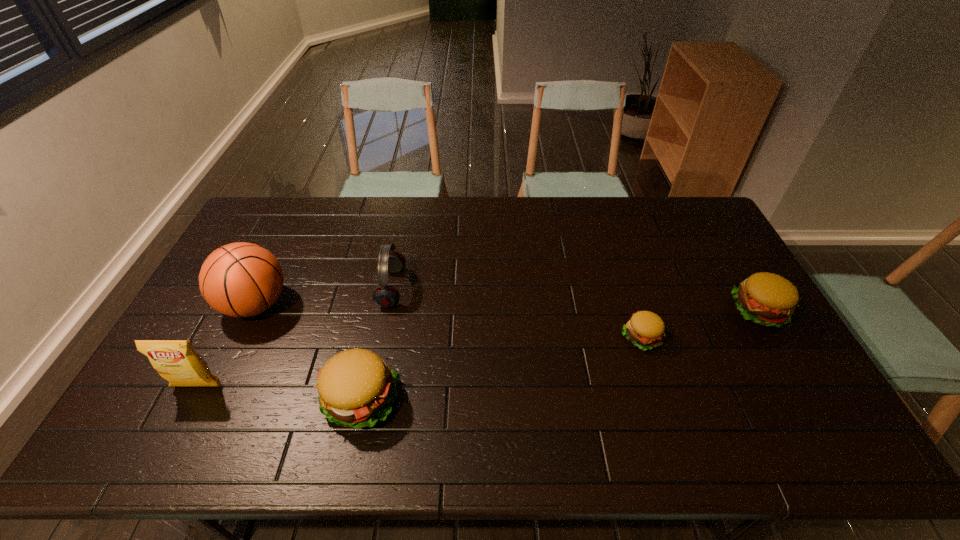
This screenshot has width=960, height=540. What are the coordinates of `vacant point that satisfies the following two spatial constraints: 1. on the back side of the nearest hamburger; 2. on the left side of the fifth object from left to right` in the screenshot? It's located at (373, 337).

Locate an element on the screen. free spot that satisfies the following two spatial constraints: 1. on the ear cups of the earphone; 2. on the left side of the fifth object from left to right is located at coordinates (382, 337).

This screenshot has height=540, width=960. In order to click on blank area in the image that satisfies the following two spatial constraints: 1. on the ear cups of the second tallest hamburger; 2. on the left side of the earphone in this screenshot , I will do `click(388, 310)`.

I want to click on free point that satisfies the following two spatial constraints: 1. on the ear cups of the earphone; 2. on the right side of the rightmost object, so click(x=388, y=310).

This screenshot has height=540, width=960. I want to click on vacant space that satisfies the following two spatial constraints: 1. on the back side of the shortest object; 2. on the right side of the rightmost hamburger, so click(x=633, y=310).